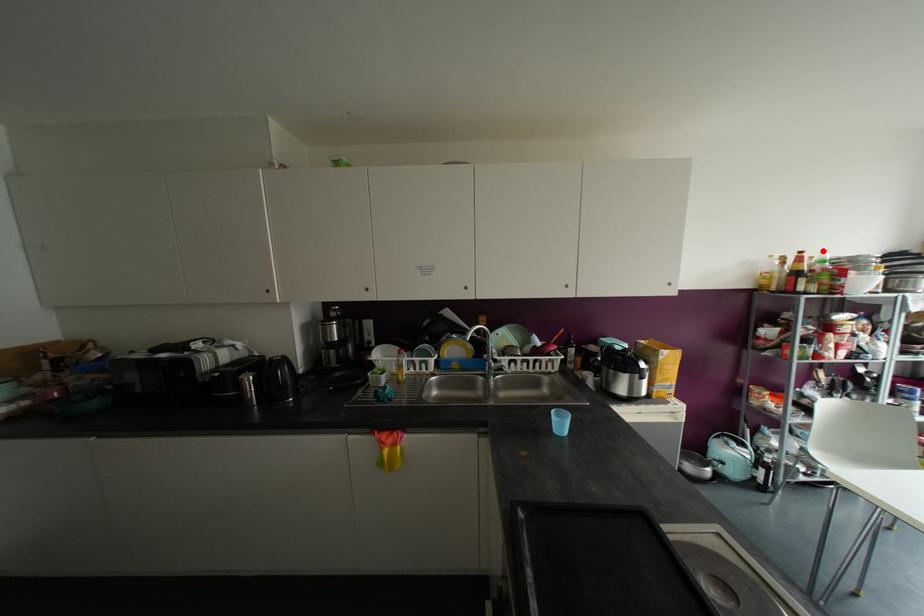
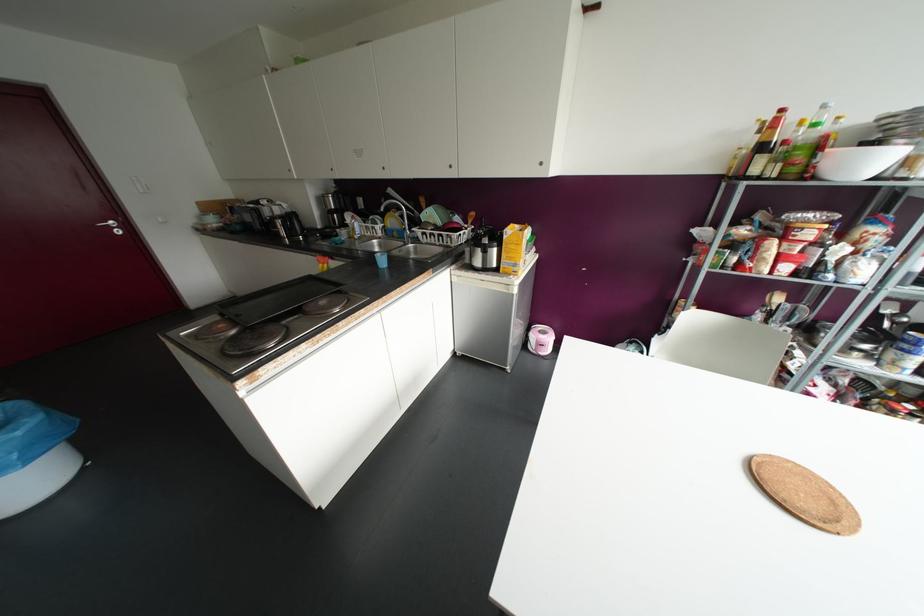
Locate, in the second image, the point that corresponds to the highlighted location in the first image.

(823, 106)